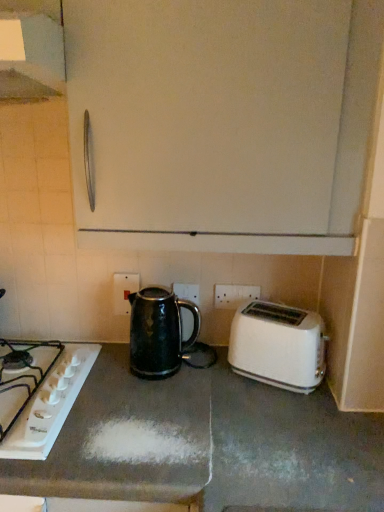
Question: Is white plastic toaster at lower right taller than white plastic electric outlet at center, which is counted as the 2th electric outlet, starting from the right?

Choices:
 (A) no
 (B) yes

Answer: (B)

Question: From a real-world perspective, is white plastic toaster at lower right over white plastic electric outlet at center, the first electric outlet from the left?

Choices:
 (A) yes
 (B) no

Answer: (B)

Question: Is white plastic electric outlet at center, which is counted as the 2th electric outlet, starting from the right, completely or partially inside white plastic toaster at lower right?

Choices:
 (A) yes
 (B) no

Answer: (B)

Question: Is white plastic toaster at lower right in front of white plastic electric outlet at center, the first electric outlet from the left?

Choices:
 (A) no
 (B) yes

Answer: (B)

Question: Is white plastic toaster at lower right at the left side of white plastic electric outlet at center, which is counted as the 2th electric outlet, starting from the right?

Choices:
 (A) yes
 (B) no

Answer: (B)

Question: In terms of height, does metallic silver exhaust hood at upper left look taller or shorter compared to white plastic electric outlet at center, the first electric outlet from the left?

Choices:
 (A) short
 (B) tall

Answer: (A)

Question: Is point (51, 9) closer or farther from the camera than point (122, 298)?

Choices:
 (A) closer
 (B) farther

Answer: (A)

Question: From the image's perspective, is metallic silver exhaust hood at upper left positioned above or below white plastic electric outlet at center, which is counted as the 2th electric outlet, starting from the right?

Choices:
 (A) above
 (B) below

Answer: (A)

Question: Considering the positions of metallic silver exhaust hood at upper left and white plastic electric outlet at center, the first electric outlet from the left, in the image, is metallic silver exhaust hood at upper left bigger or smaller than white plastic electric outlet at center, the first electric outlet from the left,?

Choices:
 (A) small
 (B) big

Answer: (B)

Question: Is black glossy kettle at center wider or thinner than metallic silver exhaust hood at upper left?

Choices:
 (A) thin
 (B) wide

Answer: (A)

Question: Visually, is black glossy kettle at center positioned to the left or to the right of metallic silver exhaust hood at upper left?

Choices:
 (A) right
 (B) left

Answer: (A)

Question: Relative to metallic silver exhaust hood at upper left, is black glossy kettle at center in front or behind?

Choices:
 (A) front
 (B) behind

Answer: (B)

Question: From their relative heights in the image, would you say black glossy kettle at center is taller or shorter than metallic silver exhaust hood at upper left?

Choices:
 (A) tall
 (B) short

Answer: (A)

Question: Relative to black glossy kettle at center, is white glossy gas stove at lower left in front or behind?

Choices:
 (A) behind
 (B) front

Answer: (B)

Question: In terms of width, does white glossy gas stove at lower left look wider or thinner when compared to black glossy kettle at center?

Choices:
 (A) wide
 (B) thin

Answer: (A)